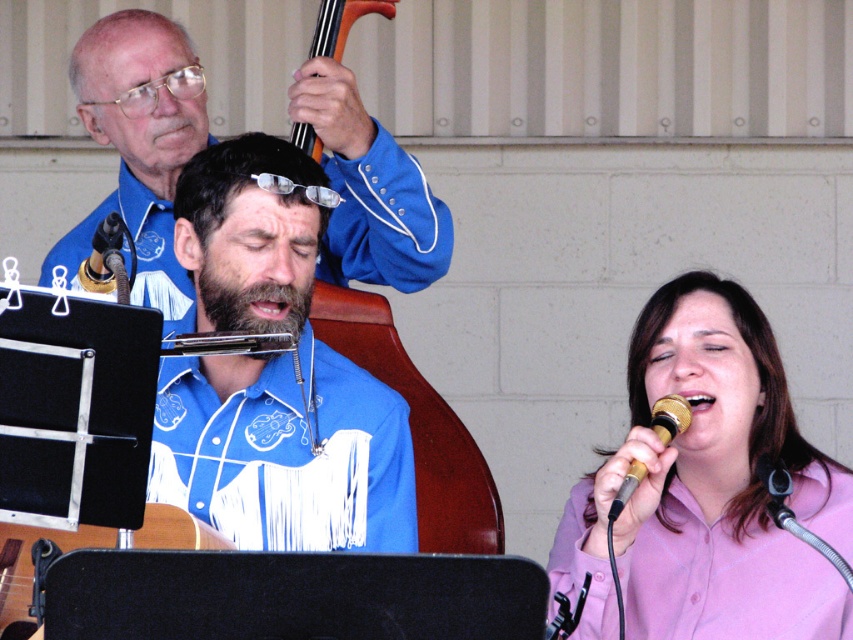
You are a photographer at the event and want to capture both the blue denim shirt at upper left and the pink satin shirt at lower right in a single frame. Given that your camera has a fixed focal length, which shirt should you focus on to ensure both are in focus?

The blue denim shirt at upper left is larger in size compared to the pink satin shirt at lower right, so focusing on the blue denim shirt at upper left would ensure both are in focus as it is closer to the camera.

You are a photographer at the event and want to capture a photo that includes both the blue denim shirt at upper left and the orange wood violin at upper center. Based on their positions, which object should you focus on first to ensure both are in the frame?

The blue denim shirt at upper left is below the orange wood violin at upper center. To include both in the frame, focus on the orange wood violin at upper center first as it is higher up, then adjust the camera angle downward to include the blue denim shirt at upper left.

You are a photographer at the event and want to capture a photo of both the blue denim shirt at upper left and the pink satin shirt at lower right. However, you need to ensure that neither of them is blocked by any other person or object. Based on their positions, can you position yourself in a way that both shirts are fully visible in the frame?

The pink satin shirt at lower right is behind the blue denim shirt at upper left, so positioning yourself to see both shirts without obstruction might be challenging. You might need to adjust your angle to ensure the pink satin shirt at lower right is not hidden behind the blue denim shirt at upper left.